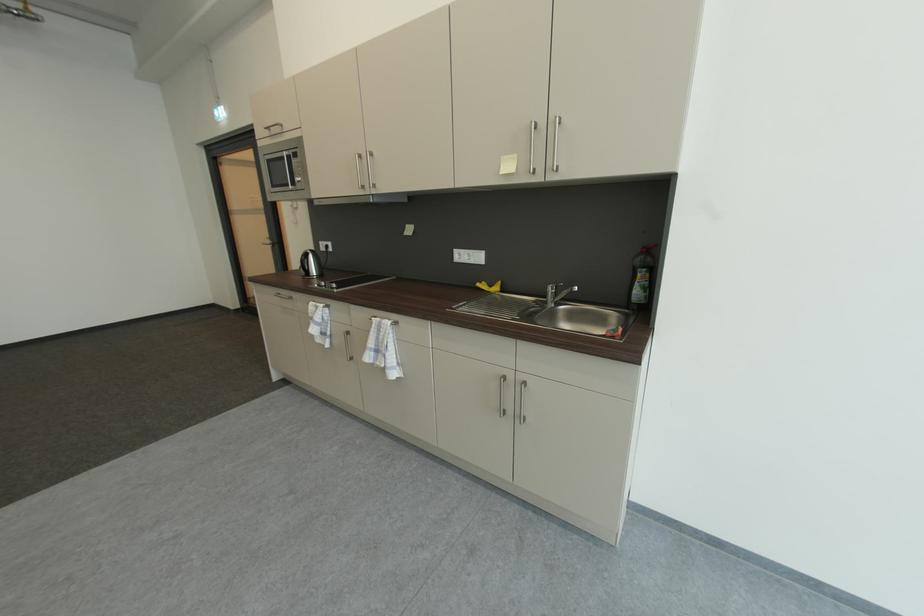
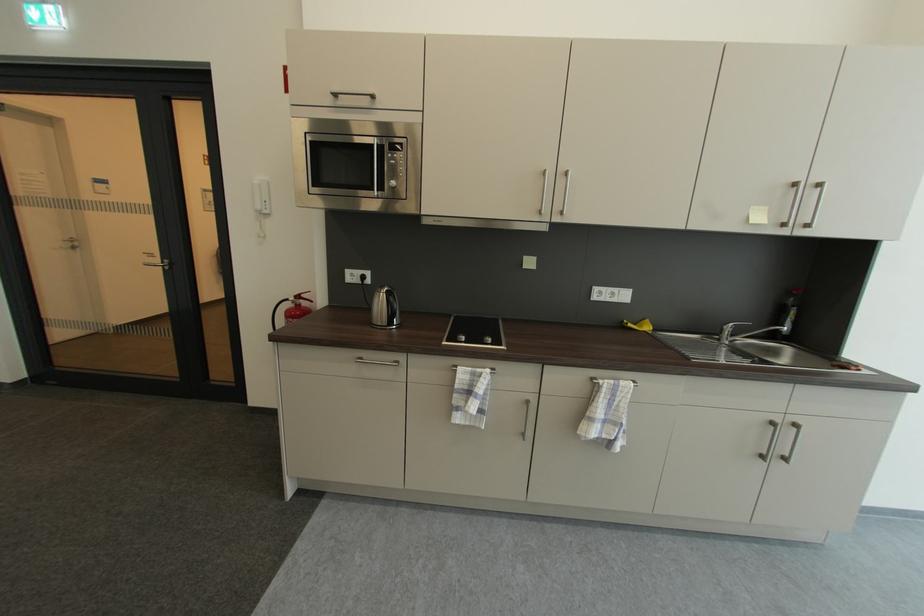
In the second image, find the point that corresponds to (x=286, y=296) in the first image.

(367, 360)